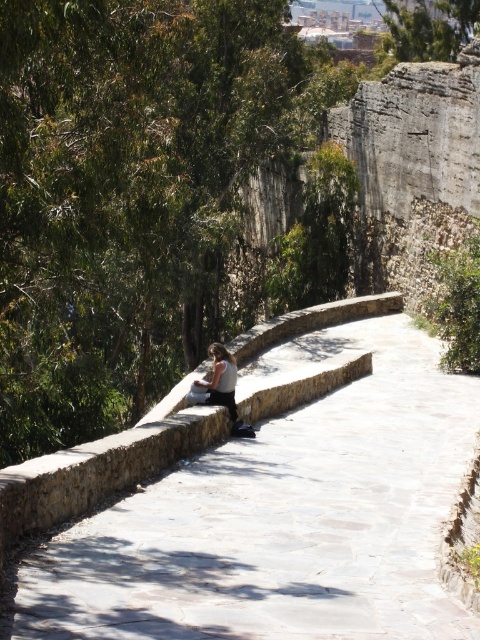
You are standing on the paved pathway and looking towards the green leafy tree at upper center and the matte white shirt at center. Which object appears bigger in your view?

The green leafy tree at upper center appears bigger than the matte white shirt at center because it is larger in size.

You are standing at the starting point of the pathway and want to reach the point marked as point (312, 408). There is an obstacle at point (228, 380). Will you encounter the obstacle before reaching your destination?

Point (312, 408) is further to the camera than point (228, 380), so you will encounter the obstacle at point (228, 380) before reaching your destination.